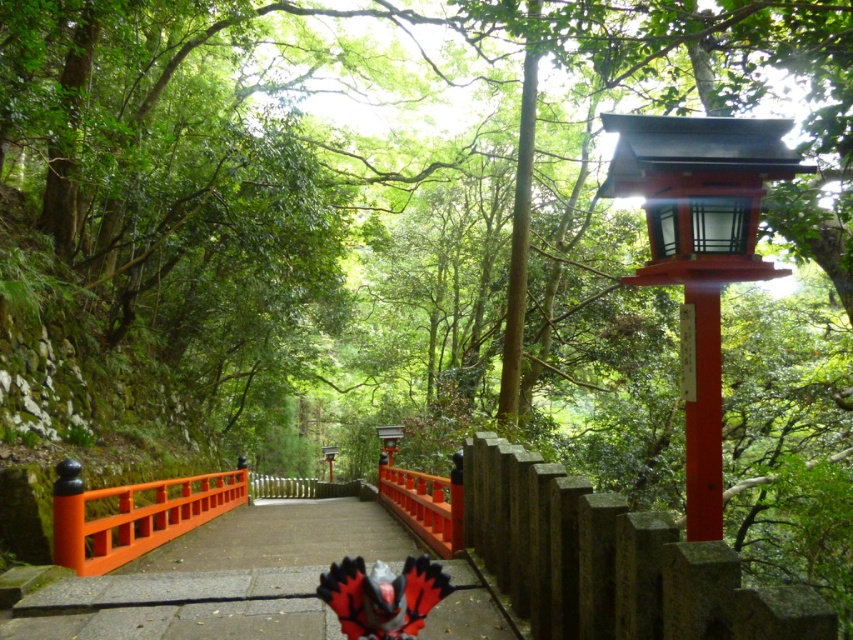
You are standing at the point marked by the coordinates point (219, 579) in the image. What is located at this point?

The point (219, 579) marks the location of a smooth wooden bridge at center.